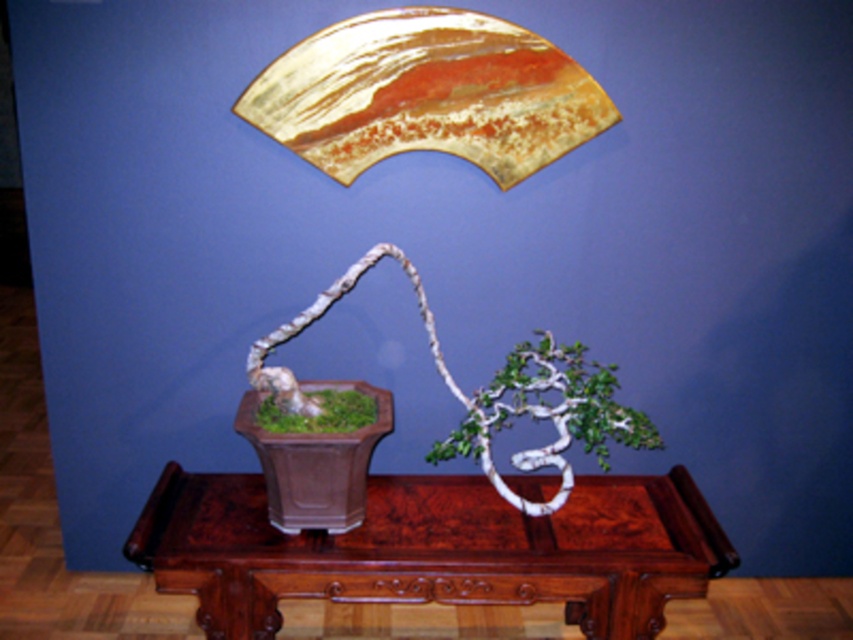
You are a florist arranging a display and need to place a vase that requires a surface higher than the green matte bonsai at center. Is the brown polished wood table at center suitable for this purpose?

The brown polished wood table at center is taller than the green matte bonsai at center, so yes, the table is suitable as it provides a higher surface than the bonsai.

You are standing at the camera position and want to place a 2 feet tall bonsai pot on the brown polished wood table at center. Can you reach the table to place the pot without moving closer?

The distance between you and the brown polished wood table at center is 7.10 feet. Since the pot is 2 feet tall, you can reach the table to place the pot without moving closer as the distance is sufficient for reaching.